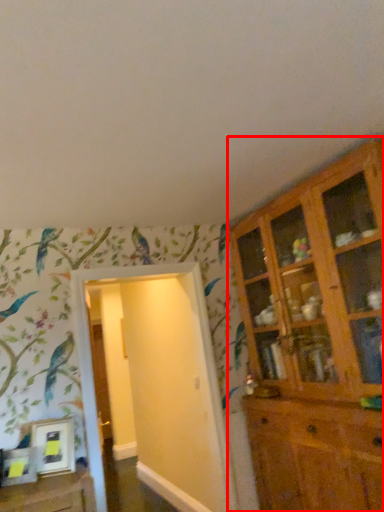
Question: From the image, what is the correct spatial relationship of cupboard (annotated by the red box) in relation to door?

Choices:
 (A) left
 (B) right

Answer: (B)